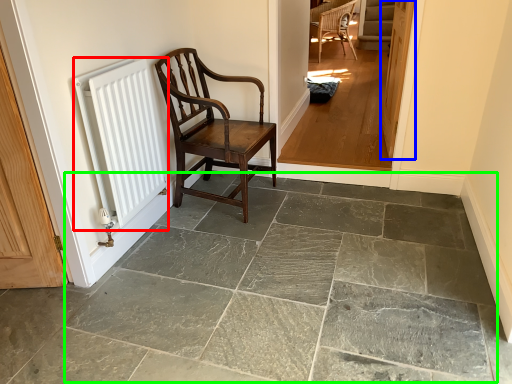
Question: Which object is positioned closest to radiator (highlighted by a red box)? Select from door (highlighted by a blue box) and limestone (highlighted by a green box).

Choices:
 (A) door
 (B) limestone

Answer: (B)